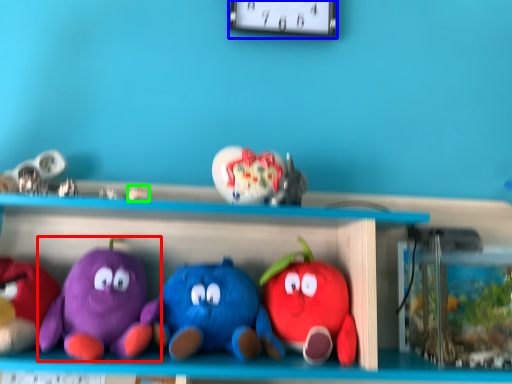
Question: Which object is the farthest from toy (highlighted by a red box)? Choose among these: clock (highlighted by a blue box) or toy (highlighted by a green box).

Choices:
 (A) clock
 (B) toy

Answer: (A)